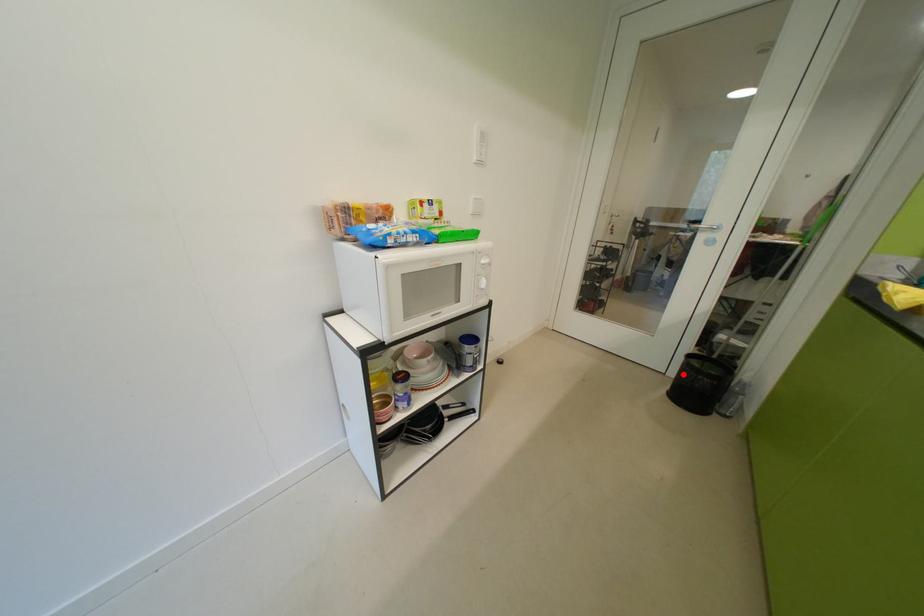
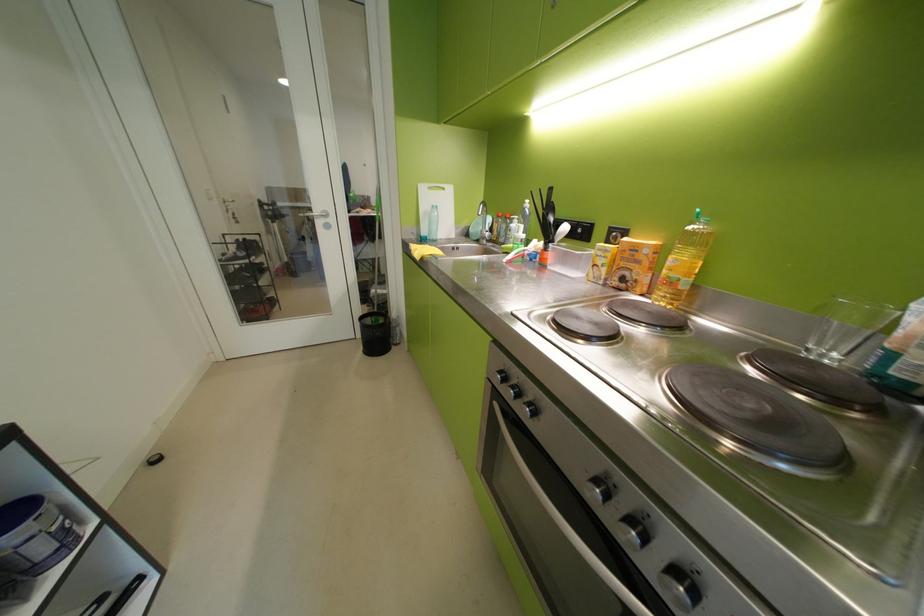
Where in the second image is the point corresponding to the highlighted location from the first image?

(370, 336)